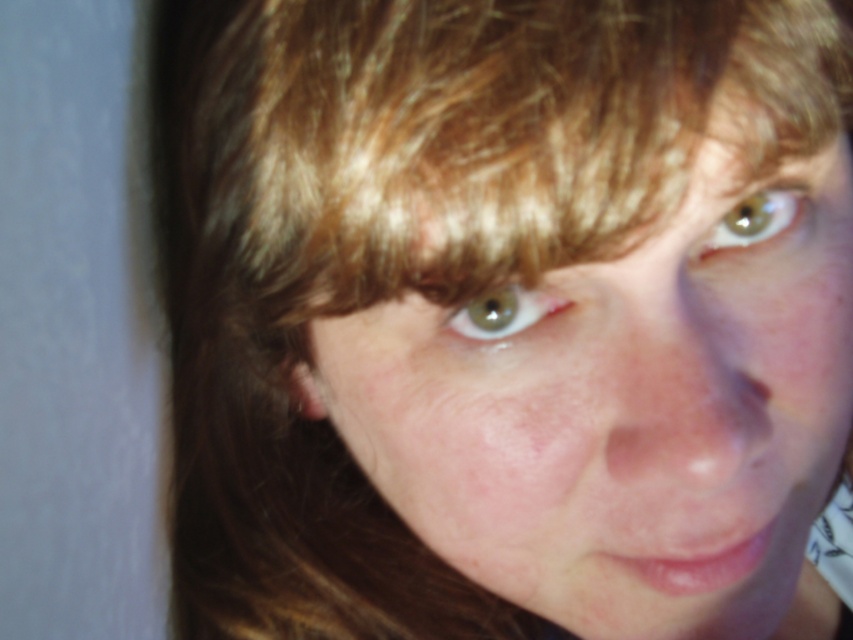
You are a photographer adjusting the lighting for a portrait. You notice the blonde hair at upper center and the green matte eye at upper right. Which object is positioned higher in the frame?

The blonde hair at upper center is positioned higher than the green matte eye at upper right.

You are an artist trying to draw the face shown in the image. The canvas is divided into a grid with coordinates from 0 to 1 on both axes. Where should you place the center of the smooth skin face at center?

The center of the smooth skin face at center should be placed at the coordinates point [627,413].

You are a photographer adjusting the focus of your camera. You want to ensure that both the smooth skin face at center and the blonde hair at upper center are in focus. Given their relative sizes in the frame, which object should you adjust the focus on first to achieve sharpness for both?

The smooth skin face at center is much taller than the blonde hair at upper center, so you should focus first on the smooth skin face at center since it occupies a larger area and will require more precise focusing to ensure both areas are sharp.